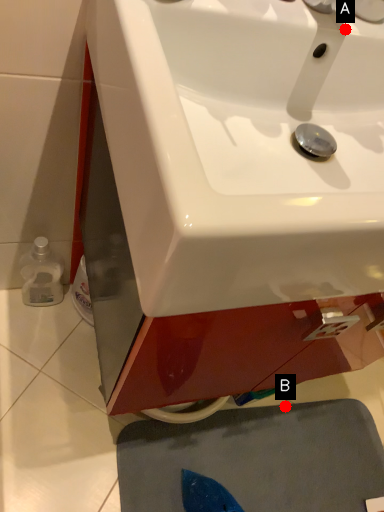
Question: Two points are circled on the image, labeled by A and B beside each circle. Which point is closer to the camera taking this photo?

Choices:
 (A) A is closer
 (B) B is closer

Answer: (A)